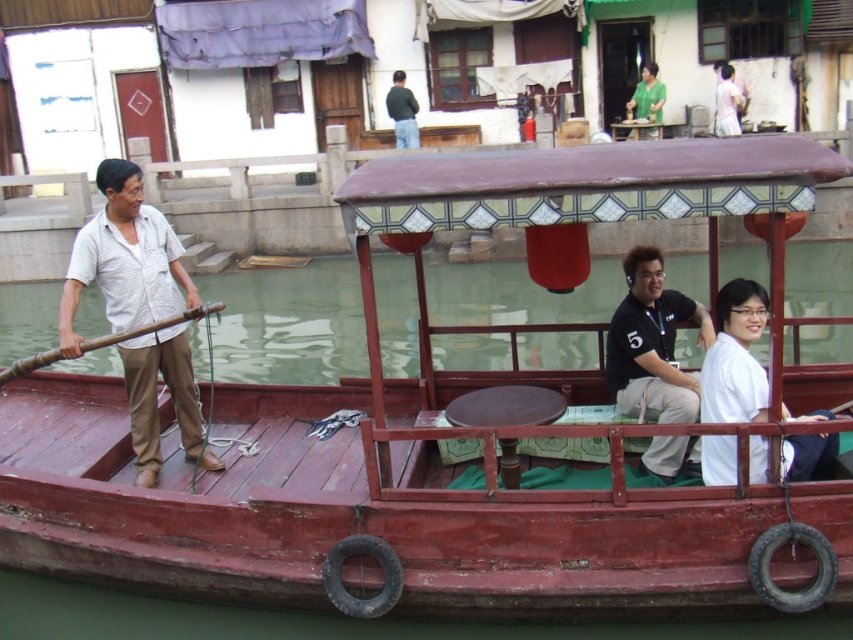
Between light brown cotton shirt at left and white matte shirt at center, which one is positioned lower?

Positioned lower is white matte shirt at center.

Can you confirm if light brown cotton shirt at left is thinner than white matte shirt at center?

Yes, light brown cotton shirt at left is thinner than white matte shirt at center.

This screenshot has height=640, width=853. What are the coordinates of `light brown cotton shirt at left` in the screenshot? It's located at (125, 259).

Image resolution: width=853 pixels, height=640 pixels. Find the location of `green matte shirt at upper center`. green matte shirt at upper center is located at coordinates (646, 97).

Is point (639, 118) closer to viewer compared to point (386, 100)?

No, it is behind (386, 100).

Between point (653, 116) and point (399, 134), which one is positioned behind?

Point (399, 134)

Locate an element on the screen. The height and width of the screenshot is (640, 853). green matte shirt at upper center is located at coordinates (646, 97).

How much distance is there between green sweater at upper center and white matte shirt at upper right?

green sweater at upper center is 18.61 feet away from white matte shirt at upper right.

Which is behind, point (399, 125) or point (718, 124)?

The point (399, 125) is behind.

At what (x,y) coordinates should I click in order to perform the action: click on green sweater at upper center. Please return your answer as a coordinate pair (x, y). Looking at the image, I should click on (402, 112).